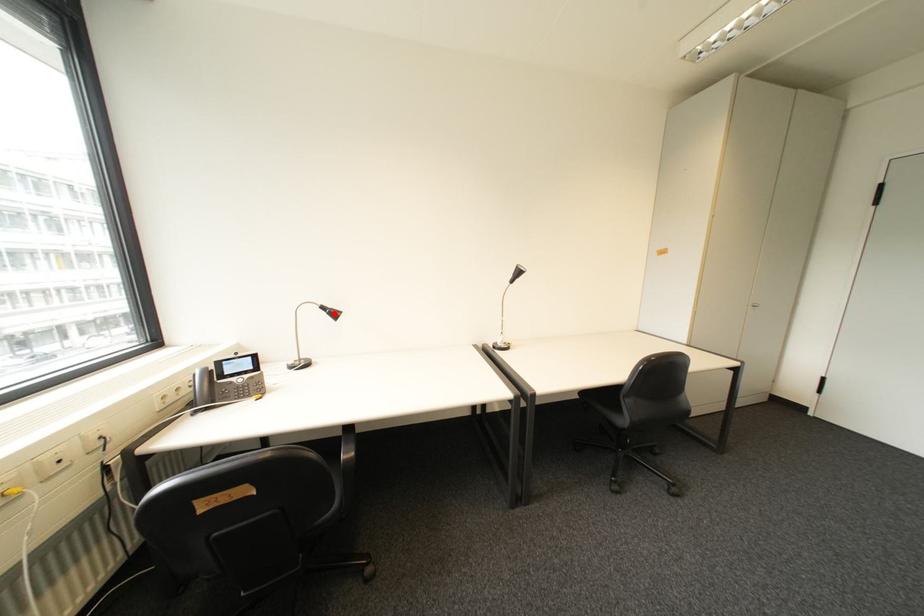
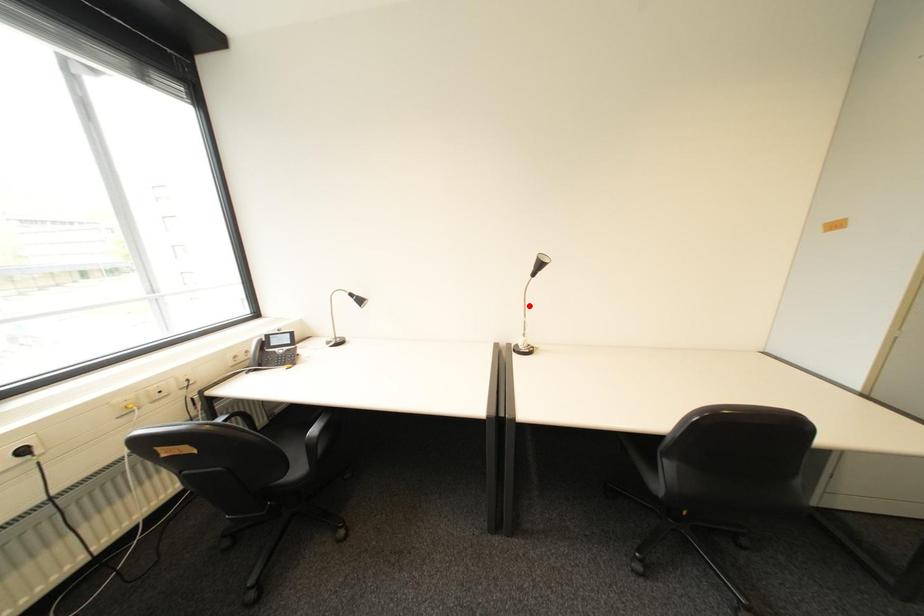
I am providing you with two images of the same scene from different viewpoints. A red point is marked on the first image and another point is marked on the second image. Are the points marked in image1 and image2 representing the same 3D position?

No